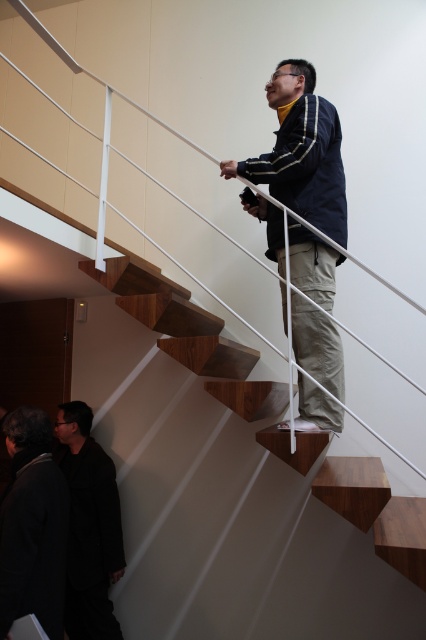
Find the location of a particular element. wooden stairs at upper center is located at coordinates (377, 512).

Is wooden stairs at upper center taller than dark gray jacket at lower left?

Yes.

Is point (141, 320) in front of point (28, 428)?

That is False.

The width and height of the screenshot is (426, 640). I want to click on wooden stairs at upper center, so click(377, 512).

Which of these two, dark gray jacket at lower left or black fabric suit at lower left, stands taller?

black fabric suit at lower left

Is the position of dark gray jacket at lower left more distant than that of black fabric suit at lower left?

No, dark gray jacket at lower left is in front of black fabric suit at lower left.

Does point (17, 449) come behind point (75, 634)?

That is False.

Locate an element on the screen. The image size is (426, 640). dark gray jacket at lower left is located at coordinates (32, 525).

Is wooden stairs at upper center thinner than black fabric suit at lower left?

No.

Is wooden stairs at upper center to the left of black fabric suit at lower left from the viewer's perspective?

Incorrect, wooden stairs at upper center is not on the left side of black fabric suit at lower left.

Does point (273, 406) come closer to viewer compared to point (92, 636)?

Yes, point (273, 406) is closer to viewer.

Where is `wooden stairs at upper center`? This screenshot has width=426, height=640. wooden stairs at upper center is located at coordinates (377, 512).